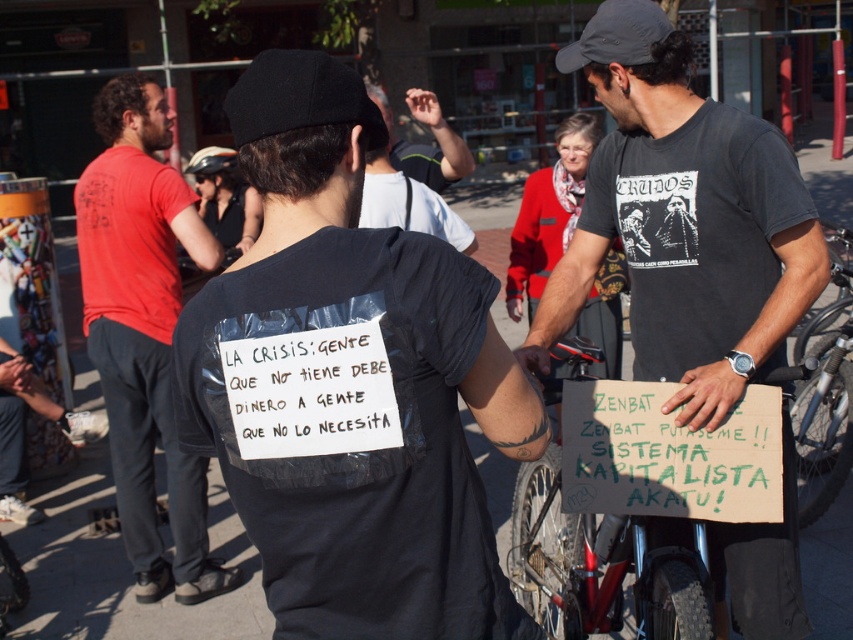
Does dark gray t-shirt at center appear on the left side of metallic silver bicycle at center?

In fact, dark gray t-shirt at center is to the right of metallic silver bicycle at center.

Which is in front, point (775, 292) or point (671, 547)?

Point (775, 292)

Does point (601, 90) lie in front of point (672, 568)?

No.

Locate an element on the screen. The width and height of the screenshot is (853, 640). dark gray t-shirt at center is located at coordinates (683, 221).

Between matte black shirt at left and metallic silver bicycle at center, which one has more height?

With more height is matte black shirt at left.

In the scene shown: Does matte black shirt at left have a greater width compared to metallic silver bicycle at center?

Correct, the width of matte black shirt at left exceeds that of metallic silver bicycle at center.

Identify the location of matte black shirt at left. The height and width of the screenshot is (640, 853). (143, 332).

Who is higher up, matte black shirt at left or white paper sign at center?

white paper sign at center is higher up.

Is matte black shirt at left positioned behind white paper sign at center?

Yes, it is.

The height and width of the screenshot is (640, 853). I want to click on matte black shirt at left, so click(143, 332).